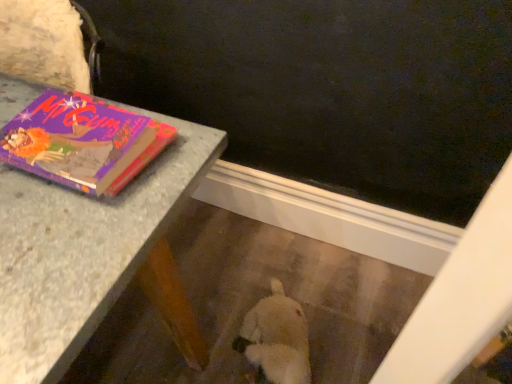
Where is `purple matte book at upper left`? This screenshot has height=384, width=512. purple matte book at upper left is located at coordinates (82, 142).

Describe the element at coordinates (82, 142) in the screenshot. I see `purple matte book at upper left` at that location.

Locate an element on the screen. granite table at upper left is located at coordinates (83, 251).

Describe the element at coordinates (83, 251) in the screenshot. The image size is (512, 384). I see `granite table at upper left` at that location.

Identify the location of purple matte book at upper left. The image size is (512, 384). (82, 142).

From the picture: Which is more to the left, purple matte book at upper left or granite table at upper left?

Positioned to the left is granite table at upper left.

Which is behind, purple matte book at upper left or granite table at upper left?

granite table at upper left.

Which point is more distant from viewer, [18,126] or [102,265]?

The point [18,126] is farther.

From the image's perspective, is purple matte book at upper left located above or below granite table at upper left?

Based on their image positions, purple matte book at upper left is located beneath granite table at upper left.

From a real-world perspective, is purple matte book at upper left on top of granite table at upper left?

Yes, from a real-world perspective, purple matte book at upper left is over granite table at upper left

Considering the sizes of objects purple matte book at upper left and granite table at upper left in the image provided, who is thinner, purple matte book at upper left or granite table at upper left?

purple matte book at upper left.

Who is taller, purple matte book at upper left or granite table at upper left?

granite table at upper left.

Is purple matte book at upper left smaller than granite table at upper left?

Yes, purple matte book at upper left is smaller than granite table at upper left.

Would you say purple matte book at upper left is inside or outside granite table at upper left?

purple matte book at upper left is not enclosed by granite table at upper left.

Are purple matte book at upper left and granite table at upper left making contact?

Yes, purple matte book at upper left is in contact with granite table at upper left.

Is purple matte book at upper left facing towards granite table at upper left?

No.

Looking at this image, how distant is purple matte book at upper left from granite table at upper left?

purple matte book at upper left and granite table at upper left are 2.55 inches apart from each other.

Where is `book on the right of granite table at upper left`? The width and height of the screenshot is (512, 384). book on the right of granite table at upper left is located at coordinates (82, 142).

Is granite table at upper left to the left of purple matte book at upper left from the viewer's perspective?

Yes, granite table at upper left is to the left of purple matte book at upper left.

In the image, is granite table at upper left positioned in front of or behind purple matte book at upper left?

In the image, granite table at upper left appears behind purple matte book at upper left.

Between point (21, 201) and point (96, 144), which one is positioned behind?

Point (96, 144)

Based on the photo, from the image's perspective, who appears lower, granite table at upper left or purple matte book at upper left?

purple matte book at upper left.

From a real-world perspective, is granite table at upper left under purple matte book at upper left?

Yes, from a real-world perspective, granite table at upper left is below purple matte book at upper left.

Does granite table at upper left have a lesser width compared to purple matte book at upper left?

No, granite table at upper left is not thinner than purple matte book at upper left.

In the scene shown: Considering the relative sizes of granite table at upper left and purple matte book at upper left in the image provided, is granite table at upper left taller than purple matte book at upper left?

Indeed, granite table at upper left has a greater height compared to purple matte book at upper left.

Between granite table at upper left and purple matte book at upper left, which one has smaller size?

With smaller size is purple matte book at upper left.

Is granite table at upper left situated inside purple matte book at upper left or outside?

granite table at upper left cannot be found inside purple matte book at upper left.

Is granite table at upper left not close to purple matte book at upper left?

granite table at upper left is actually quite close to purple matte book at upper left.

Could you tell me if granite table at upper left is facing purple matte book at upper left?

No, granite table at upper left is not oriented towards purple matte book at upper left.

How different are the orientations of granite table at upper left and purple matte book at upper left in degrees?

They differ by 1.24 degrees in their facing directions.

What are the coordinates of `table above the purple matte book at upper left (from the image's perspective)` in the screenshot? It's located at (83, 251).

This screenshot has height=384, width=512. Find the location of `table behind the purple matte book at upper left`. table behind the purple matte book at upper left is located at coordinates (83, 251).

Find the location of a particular element. Image resolution: width=512 pixels, height=384 pixels. table directly beneath the purple matte book at upper left (from a real-world perspective) is located at coordinates coord(83,251).